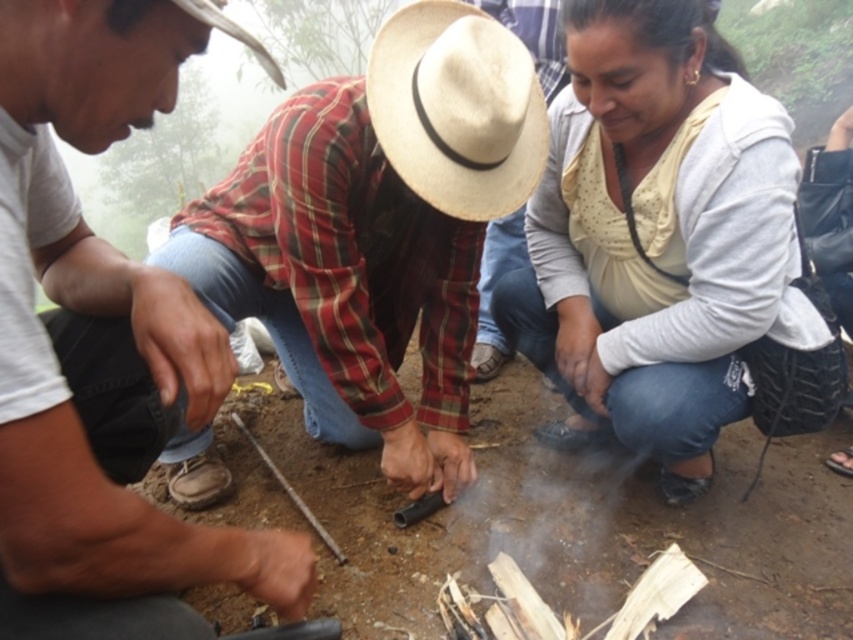
Question: Estimate the real-world distances between objects in this image. Which object is closer to the white textured sweater at center?

Choices:
 (A) woven straw hat at center
 (B) plaid fabric shirt at center

Answer: (A)

Question: Can you confirm if white textured sweater at center is positioned to the left of woven straw hat at center?

Choices:
 (A) no
 (B) yes

Answer: (A)

Question: Is white textured sweater at center to the right of woven straw hat at center from the viewer's perspective?

Choices:
 (A) yes
 (B) no

Answer: (A)

Question: Can you confirm if plaid fabric shirt at center is positioned to the right of white textured sweater at center?

Choices:
 (A) yes
 (B) no

Answer: (B)

Question: Which point is farther to the camera?

Choices:
 (A) plaid fabric shirt at center
 (B) woven straw hat at center
 (C) white textured sweater at center

Answer: (C)

Question: Which point is farther to the camera?

Choices:
 (A) white textured sweater at center
 (B) woven straw hat at center

Answer: (A)